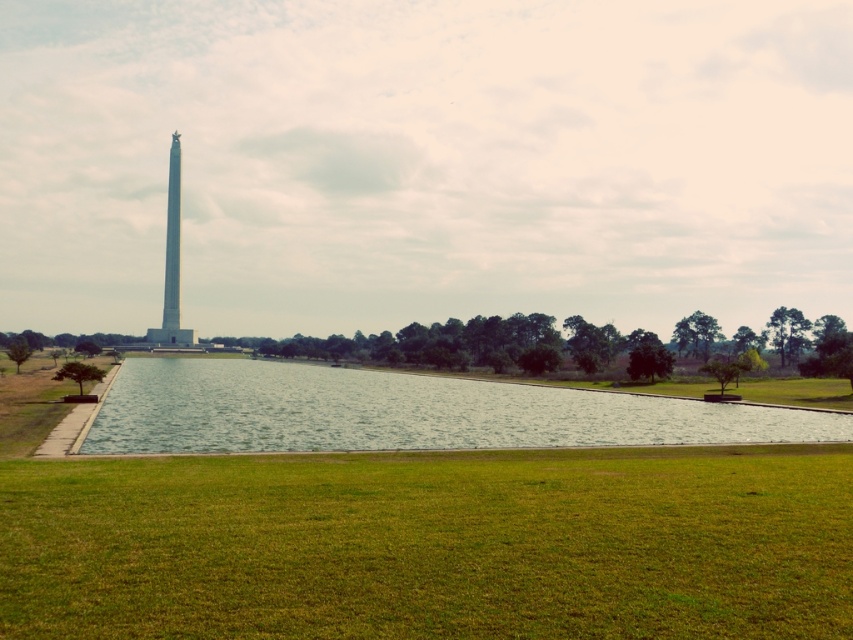
Which is behind, point (593, 624) or point (314, 372)?

The point (314, 372) is more distant.

Who is shorter, green grass at lower center or green grassy lake at center?

green grass at lower center is shorter.

What do you see at coordinates (431, 545) in the screenshot?
I see `green grass at lower center` at bounding box center [431, 545].

Find the location of a particular element. This screenshot has width=853, height=640. green grass at lower center is located at coordinates (431, 545).

Between green grass at lower center and white marble tower at center, which one has less height?

green grass at lower center

The height and width of the screenshot is (640, 853). I want to click on green grass at lower center, so click(431, 545).

I want to click on green grass at lower center, so click(431, 545).

Can you confirm if green grassy lake at center is positioned to the left of white marble tower at center?

No, green grassy lake at center is not to the left of white marble tower at center.

Does point (281, 396) come in front of point (177, 237)?

Yes.

The image size is (853, 640). What are the coordinates of `green grassy lake at center` in the screenshot? It's located at (404, 412).